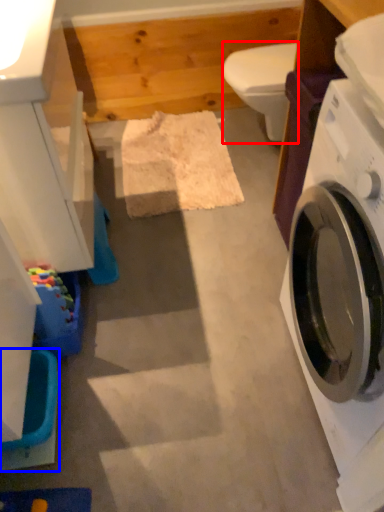
Question: Which of the following is the farthest to the observer, toilet bowl (highlighted by a red box) or washer (highlighted by a blue box)?

Choices:
 (A) toilet bowl
 (B) washer

Answer: (A)